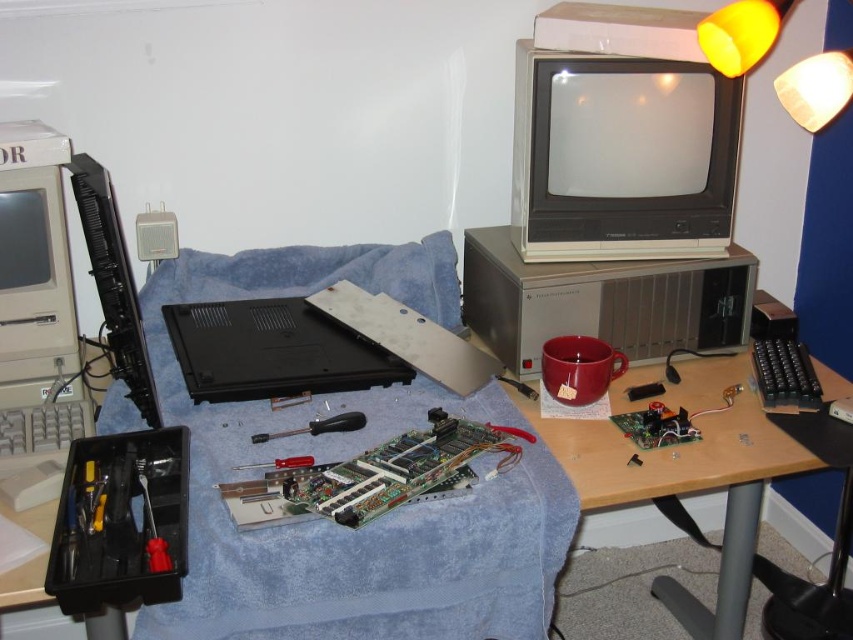
Question: Which object is farther from the camera taking this photo?

Choices:
 (A) black plastic laptop at center
 (B) satin black screwdriver at center
 (C) blue fabric blanket at center

Answer: (A)

Question: Does metallic gray desktop computer at center appear on the right side of screwdriver metallic at lower left?

Choices:
 (A) no
 (B) yes

Answer: (B)

Question: Among these objects, which one is nearest to the camera?

Choices:
 (A) matte black monitor at upper right
 (B) satin black screwdriver at center
 (C) blue fabric blanket at center

Answer: (C)

Question: Is screwdriver metallic at lower left positioned behind screwdriver at center?

Choices:
 (A) no
 (B) yes

Answer: (A)

Question: Which of the following is the closest to the observer?

Choices:
 (A) (331, 417)
 (B) (689, 340)

Answer: (A)

Question: Is black plastic laptop at center bigger than yellow plastic lampshade at upper right?

Choices:
 (A) yes
 (B) no

Answer: (A)